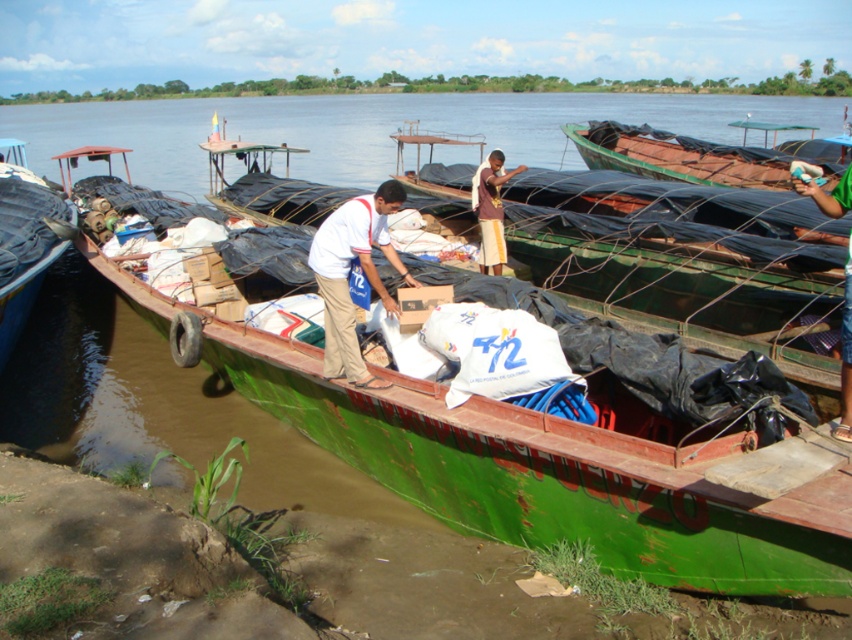
You are standing at the riverside and want to know which of the two points, point 1 at coordinates point (686, 452) or point 2 at coordinates point (740, 179), is closer to you. Can you determine this based on the scene?

Point 1 at coordinates point (686, 452) is closer to you than point 2 at coordinates point (740, 179).

You are standing on the dock and see the green fabric shirt at upper right and the brown woven cloth at center. Which object is nearer to you?

The green fabric shirt at upper right is closer to the viewer than the brown woven cloth at center.